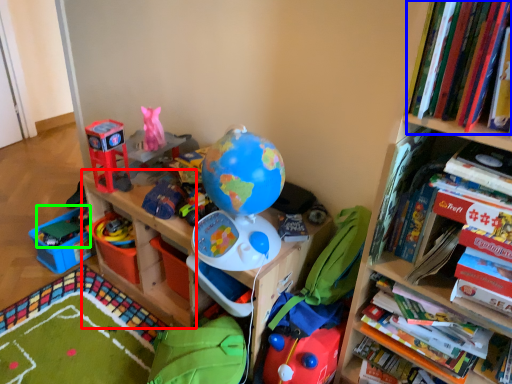
Question: Estimate the real-world distances between objects in this image. Which object is closer to shelf (highlighted by a red box), book (highlighted by a blue box) or toy (highlighted by a green box)?

Choices:
 (A) book
 (B) toy

Answer: (B)